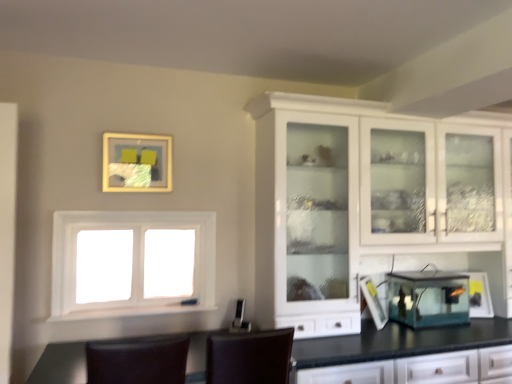
Locate an element on the screen. This screenshot has height=384, width=512. free location above white matte window at center (from a real-world perspective) is located at coordinates (138, 213).